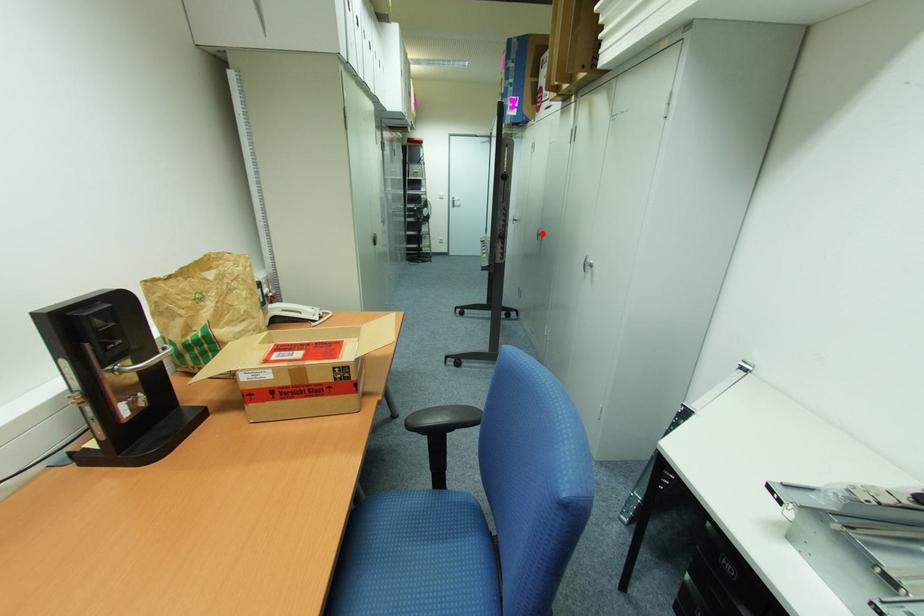
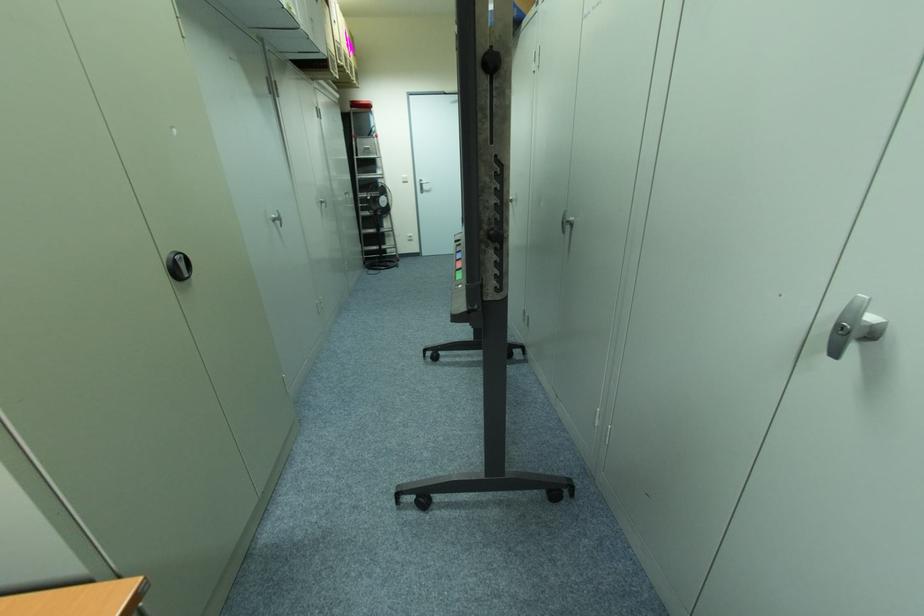
The point at the highlighted location is marked in the first image. Where is the corresponding point in the second image?

(572, 219)